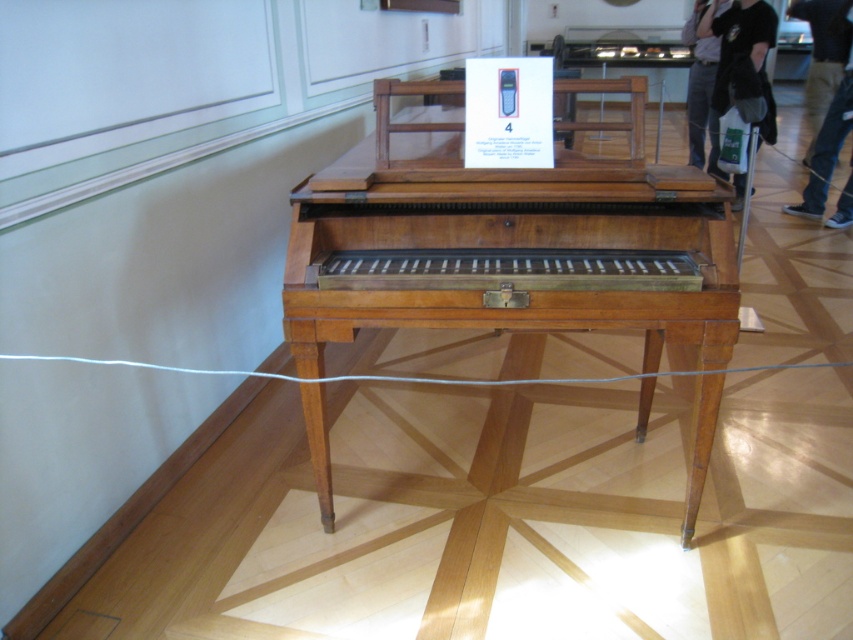
Question: Is brown denim pants at lower right to the left of denim pants at right from the viewer's perspective?

Choices:
 (A) no
 (B) yes

Answer: (A)

Question: Which object is closer to the camera taking this photo?

Choices:
 (A) brown denim pants at lower right
 (B) denim pants at right

Answer: (A)

Question: Among these points, which one is nearest to the camera?

Choices:
 (A) (766, 77)
 (B) (706, 72)
 (C) (814, 195)
 (D) (575, 225)

Answer: (D)

Question: Considering the real-world distances, which object is farthest from the wooden piano at center?

Choices:
 (A) denim pants at right
 (B) brown denim pants at lower right
 (C) black fabric bag at upper right

Answer: (A)

Question: Does wooden piano at center have a greater width compared to black fabric bag at upper right?

Choices:
 (A) yes
 (B) no

Answer: (A)

Question: Is black fabric bag at upper right further to camera compared to denim pants at right?

Choices:
 (A) yes
 (B) no

Answer: (B)